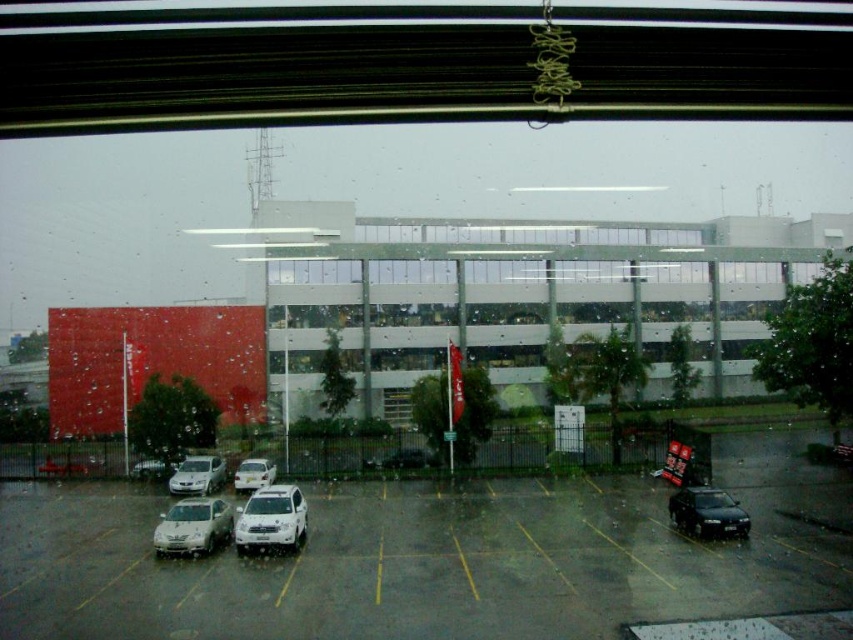
Does point (178, 515) come behind point (189, 460)?

No, (178, 515) is in front of (189, 460).

Does satin silver suv at lower left have a lesser width compared to satin silver sedan at lower center?

Correct, satin silver suv at lower left's width is less than satin silver sedan at lower center's.

Is point (218, 525) closer to camera compared to point (219, 483)?

Yes.

Where is `satin silver suv at lower left`? The width and height of the screenshot is (853, 640). satin silver suv at lower left is located at coordinates (193, 525).

Can you confirm if white glossy building at center is thinner than satin silver suv at lower left?

In fact, white glossy building at center might be wider than satin silver suv at lower left.

Between white glossy building at center and satin silver suv at lower left, which one is positioned lower?

satin silver suv at lower left is lower down.

Find the location of a particular element. This screenshot has height=640, width=853. white glossy building at center is located at coordinates (518, 292).

Based on the photo, is satin silver suv at lower left in front of satin black sedan at lower right?

That is True.

In the scene shown: Can you confirm if satin silver suv at lower left is positioned below satin black sedan at lower right?

Yes.

Between point (181, 522) and point (704, 490), which one is positioned behind?

Positioned behind is point (704, 490).

Where is `satin silver suv at lower left`? The image size is (853, 640). satin silver suv at lower left is located at coordinates (193, 525).